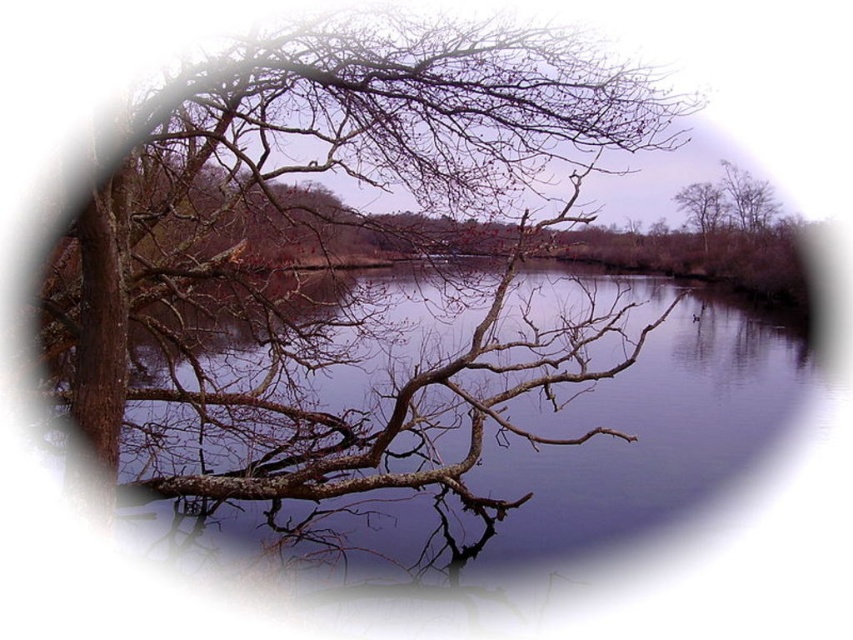
You are standing in the scene and want to walk towards the smooth water at center and the brown rough tree at upper right. Which object will you reach first?

You will reach the smooth water at center first because it is closer to the viewer than the brown rough tree at upper right.

You are an artist sketching this scene. You want to draw the brown rough tree at upper right and the brown rough tree at upper center first. Which tree should you draw first to ensure proper placement?

You should draw the brown rough tree at upper center first because the brown rough tree at upper right is positioned to its right, so starting with the central tree ensures the right tree can be placed correctly relative to it.